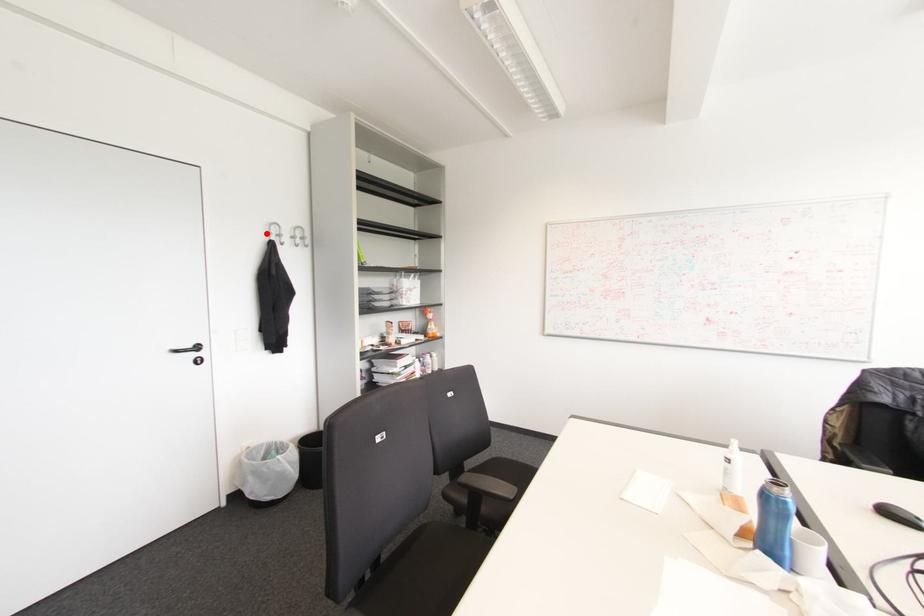
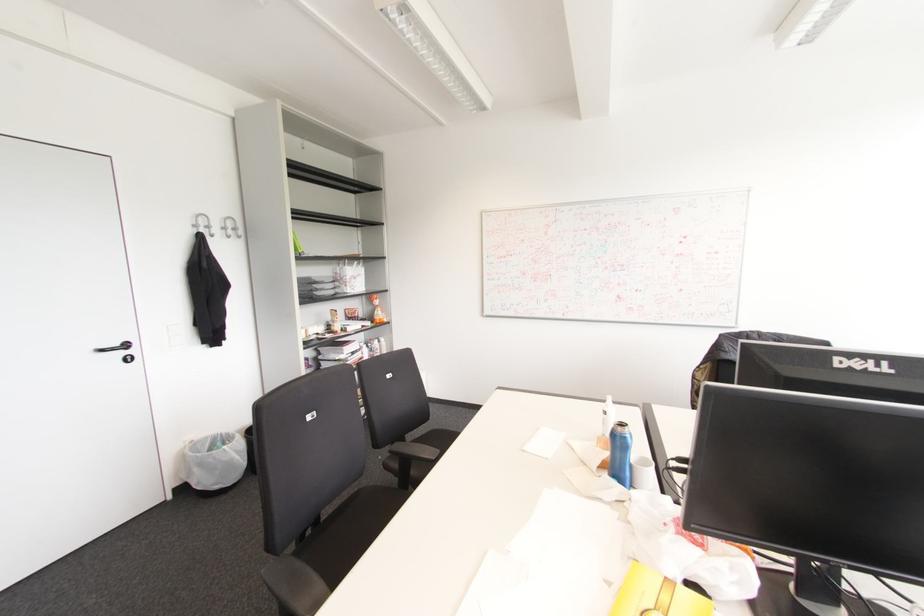
Find the pixel in the second image that matches the highlighted location in the first image.

(195, 225)